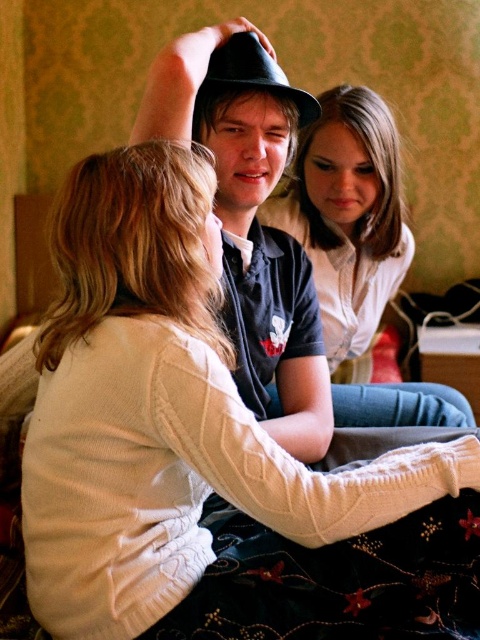
In the scene shown: You are organizing a photoshoot and need to ensure that the smooth white shirt at center and the matte black hat at center are visible in the frame. Given that the camera has a fixed focal length, which object should you prioritize positioning closer to the camera to ensure both are in focus?

The smooth white shirt at center has a larger width than the matte black hat at center, so you should prioritize positioning the smooth white shirt at center closer to the camera to ensure both are in focus.